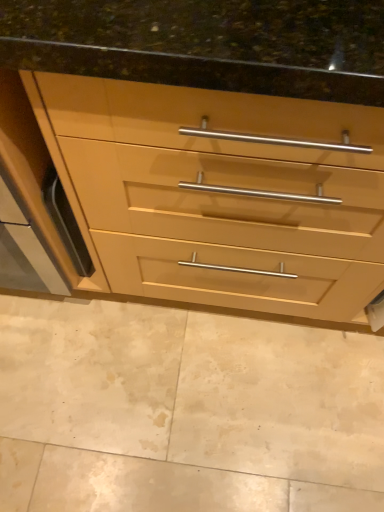
Question: Can you confirm if beige marble floor at lower center is bigger than matte wood chest of drawers at center?

Choices:
 (A) yes
 (B) no

Answer: (B)

Question: Can you confirm if beige marble floor at lower center is wider than matte wood chest of drawers at center?

Choices:
 (A) no
 (B) yes

Answer: (B)

Question: Is beige marble floor at lower center behind matte wood chest of drawers at center?

Choices:
 (A) no
 (B) yes

Answer: (B)

Question: Is beige marble floor at lower center oriented towards matte wood chest of drawers at center?

Choices:
 (A) yes
 (B) no

Answer: (B)

Question: From a real-world perspective, is beige marble floor at lower center below matte wood chest of drawers at center?

Choices:
 (A) no
 (B) yes

Answer: (B)

Question: Can you confirm if beige marble floor at lower center is positioned to the right of matte wood chest of drawers at center?

Choices:
 (A) yes
 (B) no

Answer: (B)

Question: Would you say beige marble floor at lower center is part of matte wood chest of drawers at center's contents?

Choices:
 (A) yes
 (B) no

Answer: (B)

Question: Does matte wood chest of drawers at center have a lesser height compared to beige marble floor at lower center?

Choices:
 (A) no
 (B) yes

Answer: (A)

Question: From the image's perspective, is matte wood chest of drawers at center on beige marble floor at lower center?

Choices:
 (A) no
 (B) yes

Answer: (B)

Question: Considering the relative sizes of matte wood chest of drawers at center and beige marble floor at lower center in the image provided, is matte wood chest of drawers at center thinner than beige marble floor at lower center?

Choices:
 (A) yes
 (B) no

Answer: (A)

Question: Is matte wood chest of drawers at center in front of beige marble floor at lower center?

Choices:
 (A) yes
 (B) no

Answer: (A)

Question: From a real-world perspective, does matte wood chest of drawers at center sit lower than beige marble floor at lower center?

Choices:
 (A) yes
 (B) no

Answer: (B)

Question: From a real-world perspective, relative to beige marble floor at lower center, is matte wood chest of drawers at center vertically above or below?

Choices:
 (A) below
 (B) above

Answer: (B)